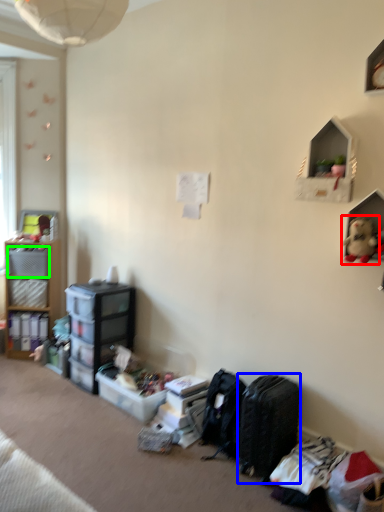
Question: Estimate the real-world distances between objects in this image. Which object is farther from toy (highlighted by a red box), luggage (highlighted by a blue box) or storage box (highlighted by a green box)?

Choices:
 (A) luggage
 (B) storage box

Answer: (B)